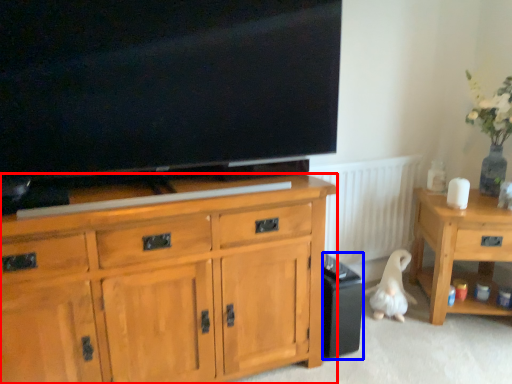
Question: Which object appears closest to the camera in this image, cabinetry (highlighted by a red box) or loudspeaker (highlighted by a blue box)?

Choices:
 (A) cabinetry
 (B) loudspeaker

Answer: (A)